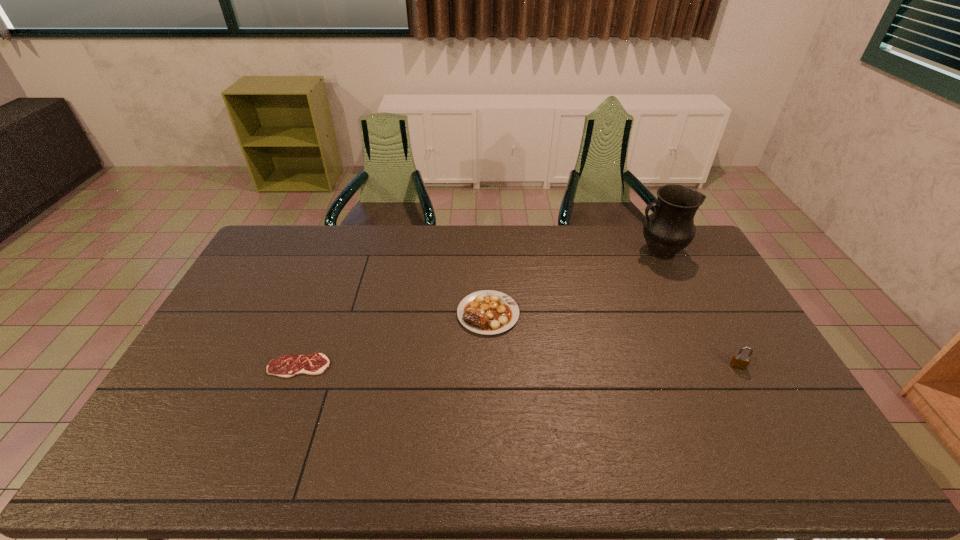
At what (x,y) coordinates should I click in order to perform the action: click on vacant space situated 0.350m on the back of the second tallest object. Please return your answer as a coordinate pair (x, y). The image size is (960, 540). Looking at the image, I should click on (692, 283).

Where is `free space located on the front of the taller steak`? This screenshot has width=960, height=540. free space located on the front of the taller steak is located at coordinates (490, 379).

The width and height of the screenshot is (960, 540). In order to click on vacant point located on the front of the nearer steak in this screenshot , I will do `click(282, 409)`.

Where is `object situated at the far edge`? The width and height of the screenshot is (960, 540). object situated at the far edge is located at coordinates (670, 228).

You are a GUI agent. You are given a task and a screenshot of the screen. Output one action in this format:
    pyautogui.click(x=<x>, y=<y>)
    Task: Click on the pitcher situated at the right edge
    Image resolution: width=960 pixels, height=540 pixels.
    Given the screenshot: What is the action you would take?
    pyautogui.click(x=670, y=228)

You are a GUI agent. You are given a task and a screenshot of the screen. Output one action in this format:
    pyautogui.click(x=<x>, y=<y>)
    Task: Click on the padlock that is positioned at the right edge
    The width and height of the screenshot is (960, 540).
    Given the screenshot: What is the action you would take?
    pyautogui.click(x=739, y=361)

Identify the location of object located at the far right corner. (670, 228).

In the image, there is a desktop. Where is `vacant space at the far edge`? The width and height of the screenshot is (960, 540). vacant space at the far edge is located at coordinates (571, 232).

In the image, there is a desktop. Find the location of `vacant space at the near edge`. vacant space at the near edge is located at coordinates (407, 462).

Where is `vacant space at the left edge of the desktop`? This screenshot has height=540, width=960. vacant space at the left edge of the desktop is located at coordinates (268, 306).